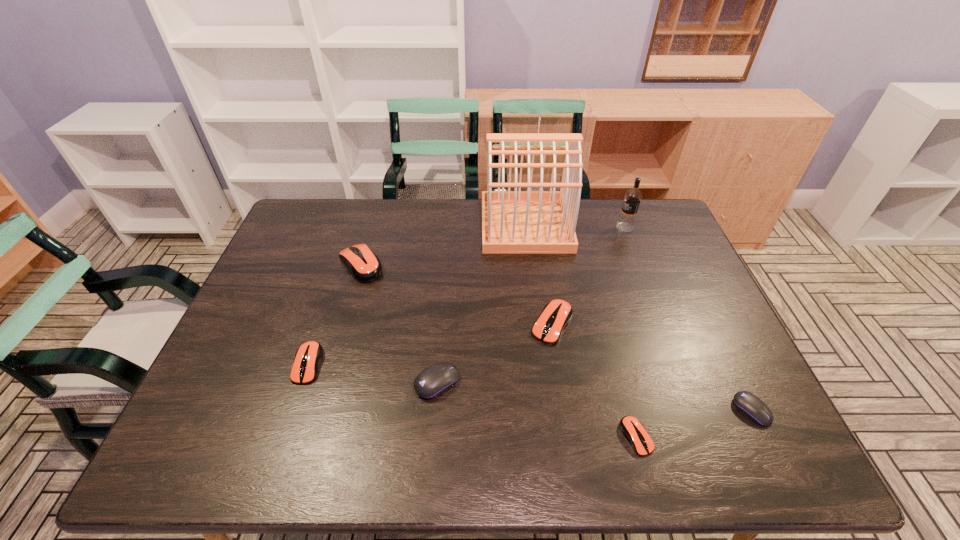
What are the coordinates of `free space in the image that satisfies the following two spatial constraints: 1. on the label of the seventh object from left to right; 2. on the back side of the smaller black computer mouse` in the screenshot? It's located at (695, 410).